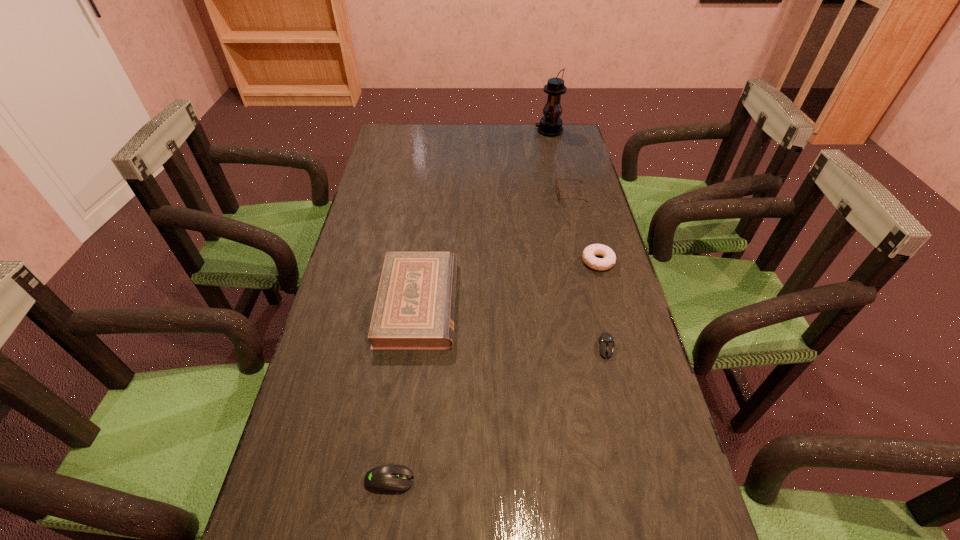
Locate an element on the screen. object at the left edge is located at coordinates (x=414, y=309).

Image resolution: width=960 pixels, height=540 pixels. Find the location of `lantern positioned at the right edge`. lantern positioned at the right edge is located at coordinates (550, 125).

You are a GUI agent. You are given a task and a screenshot of the screen. Output one action in this format:
    pyautogui.click(x=<x>, y=<y>)
    Task: Click on the sunglasses that is at the right edge
    Image resolution: width=960 pixels, height=540 pixels.
    Given the screenshot: What is the action you would take?
    pyautogui.click(x=556, y=188)

I want to click on doughnut present at the right edge, so click(589, 253).

Image resolution: width=960 pixels, height=540 pixels. I want to click on computer mouse that is at the right edge, so click(x=606, y=341).

I want to click on object at the far right corner, so click(x=550, y=125).

The width and height of the screenshot is (960, 540). In the image, there is a desktop. What are the coordinates of `vacant region at the far edge` in the screenshot? It's located at (496, 147).

In the image, there is a desktop. Where is `blank space at the left edge`? blank space at the left edge is located at coordinates (383, 239).

The width and height of the screenshot is (960, 540). In the image, there is a desktop. Find the location of `vacant space at the right edge`. vacant space at the right edge is located at coordinates (563, 175).

Image resolution: width=960 pixels, height=540 pixels. Identify the location of vacant position at the far left corner of the desktop. coord(399,145).